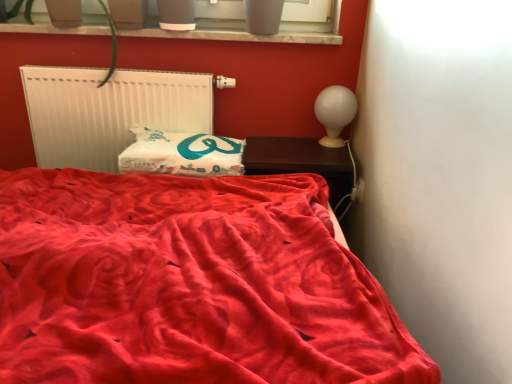
This screenshot has width=512, height=384. Describe the element at coordinates (188, 284) in the screenshot. I see `velvet red bed at center` at that location.

The height and width of the screenshot is (384, 512). What do you see at coordinates (237, 36) in the screenshot? I see `smooth concrete window sill at upper center` at bounding box center [237, 36].

The height and width of the screenshot is (384, 512). What do you see at coordinates (335, 113) in the screenshot?
I see `white glossy table lamp at upper right` at bounding box center [335, 113].

Where is `velvet red bed at center`? velvet red bed at center is located at coordinates (188, 284).

Is white glossy table lamp at upper right oriented away from dark wood nightstand at right?

No.

From the image's perspective, which object appears higher, white glossy table lamp at upper right or dark wood nightstand at right?

white glossy table lamp at upper right.

In the scene shown: Between white glossy table lamp at upper right and dark wood nightstand at right, which one is positioned in front?

dark wood nightstand at right.

From a real-world perspective, between white soft pillow at center and velvet red bed at center, who is vertically lower?

velvet red bed at center.

Does white soft pillow at center have a smaller size compared to velvet red bed at center?

Correct, white soft pillow at center occupies less space than velvet red bed at center.

Does white soft pillow at center have a lesser height compared to velvet red bed at center?

Correct, white soft pillow at center is not as tall as velvet red bed at center.

Could you tell me if white soft pillow at center is facing velvet red bed at center?

Yes, white soft pillow at center faces towards velvet red bed at center.

Considering the relative sizes of white soft pillow at center and white matte radiator at upper left in the image provided, is white soft pillow at center bigger than white matte radiator at upper left?

No.

Between white soft pillow at center and white matte radiator at upper left, which one appears on the left side from the viewer's perspective?

Positioned to the left is white matte radiator at upper left.

Is white soft pillow at center thinner than white matte radiator at upper left?

No, white soft pillow at center is not thinner than white matte radiator at upper left.

Considering the points (201, 173) and (130, 83), which point is in front, point (201, 173) or point (130, 83)?

The point (201, 173) is closer.

Based on the photo, is velvet red bed at center bigger or smaller than smooth concrete window sill at upper center?

Considering their sizes, velvet red bed at center takes up more space than smooth concrete window sill at upper center.

From the image's perspective, is velvet red bed at center positioned above or below smooth concrete window sill at upper center?

From the image's perspective, velvet red bed at center appears below smooth concrete window sill at upper center.

Is velvet red bed at center further to camera compared to smooth concrete window sill at upper center?

No, velvet red bed at center is in front of smooth concrete window sill at upper center.

From a real-world perspective, is dark wood nightstand at right above or below white matte radiator at upper left?

Clearly, from a real-world perspective, dark wood nightstand at right is below white matte radiator at upper left.

What's the angular difference between dark wood nightstand at right and white matte radiator at upper left's facing directions?

The angular difference between dark wood nightstand at right and white matte radiator at upper left is 1.5 degrees.

Considering the relative sizes of dark wood nightstand at right and white matte radiator at upper left in the image provided, is dark wood nightstand at right taller than white matte radiator at upper left?

In fact, dark wood nightstand at right may be shorter than white matte radiator at upper left.

Considering the relative positions of dark wood nightstand at right and white matte radiator at upper left in the image provided, is dark wood nightstand at right behind white matte radiator at upper left?

No, dark wood nightstand at right is closer to the camera.

Does white glossy table lamp at upper right have a larger size compared to velvet red bed at center?

No, white glossy table lamp at upper right is not bigger than velvet red bed at center.

Can you confirm if white glossy table lamp at upper right is positioned to the right of velvet red bed at center?

Yes.

Considering the relative sizes of white glossy table lamp at upper right and velvet red bed at center in the image provided, is white glossy table lamp at upper right taller than velvet red bed at center?

No.

From the image's perspective, relative to velvet red bed at center, is white glossy table lamp at upper right above or below?

Based on their image positions, white glossy table lamp at upper right is located above velvet red bed at center.

What are the coordinates of `bed on the right of smooth concrete window sill at upper center` in the screenshot? It's located at (188, 284).

Which point is more forward, (34, 29) or (374, 369)?

The point (374, 369) is in front.

Does smooth concrete window sill at upper center have a smaller size compared to velvet red bed at center?

Indeed, smooth concrete window sill at upper center has a smaller size compared to velvet red bed at center.

Where is `table lamp located above the dark wood nightstand at right (from the image's perspective)`? This screenshot has width=512, height=384. table lamp located above the dark wood nightstand at right (from the image's perspective) is located at coordinates (335, 113).

Locate an element on the screen. pillow that is on the right side of velvet red bed at center is located at coordinates (182, 154).

Consider the image. Based on their spatial positions, is velvet red bed at center or white glossy table lamp at upper right further from dark wood nightstand at right?

velvet red bed at center.

Estimate the real-world distances between objects in this image. Which object is further from dark wood nightstand at right, white soft pillow at center or velvet red bed at center?

velvet red bed at center is positioned further to the anchor dark wood nightstand at right.

Based on their spatial positions, is smooth concrete window sill at upper center or white glossy table lamp at upper right closer to dark wood nightstand at right?

white glossy table lamp at upper right lies closer to dark wood nightstand at right than the other object.

Estimate the real-world distances between objects in this image. Which object is further from smooth concrete window sill at upper center, white glossy table lamp at upper right or white soft pillow at center?

white soft pillow at center is further to smooth concrete window sill at upper center.

Looking at this image, estimate the real-world distances between objects in this image. Which object is closer to smooth concrete window sill at upper center, white matte radiator at upper left or dark wood nightstand at right?

white matte radiator at upper left lies closer to smooth concrete window sill at upper center than the other object.

From the image, which object appears to be farther from velvet red bed at center, white matte radiator at upper left or smooth concrete window sill at upper center?

smooth concrete window sill at upper center.

Which object lies nearer to the anchor point velvet red bed at center, smooth concrete window sill at upper center or white glossy table lamp at upper right?

white glossy table lamp at upper right.

Looking at this image, which object lies nearer to the anchor point smooth concrete window sill at upper center, white matte radiator at upper left or white soft pillow at center?

Based on the image, white matte radiator at upper left appears to be nearer to smooth concrete window sill at upper center.

Where is `furniture between velvet red bed at center and smooth concrete window sill at upper center in the front-back direction`? Image resolution: width=512 pixels, height=384 pixels. furniture between velvet red bed at center and smooth concrete window sill at upper center in the front-back direction is located at coordinates (300, 161).

Find the location of a particular element. The width and height of the screenshot is (512, 384). table lamp between velvet red bed at center and white matte radiator at upper left from front to back is located at coordinates (335, 113).

This screenshot has width=512, height=384. What are the coordinates of `window sill located between velvet red bed at center and white matte radiator at upper left in the depth direction` in the screenshot? It's located at (237, 36).

Where is `window sill between white matte radiator at upper left and dark wood nightstand at right`? The width and height of the screenshot is (512, 384). window sill between white matte radiator at upper left and dark wood nightstand at right is located at coordinates [237, 36].